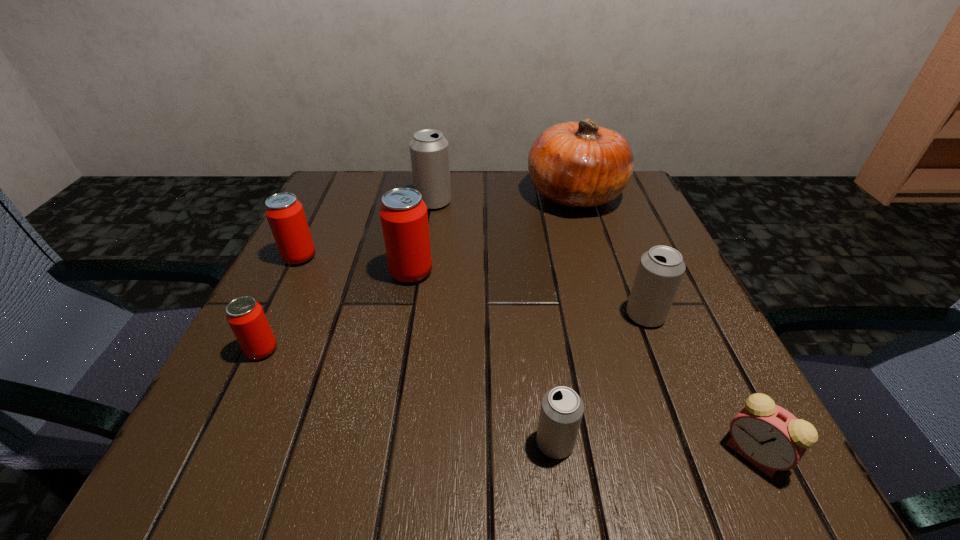
You are a GUI agent. You are given a task and a screenshot of the screen. Output one action in this format:
    pyautogui.click(x=<x>, y=<y>)
    Task: Click on the free space located on the face of the pink alarm clock
    The width and height of the screenshot is (960, 540).
    Given the screenshot: What is the action you would take?
    pyautogui.click(x=602, y=454)

Where is `free space located 0.130m on the face of the pink alarm clock`? The width and height of the screenshot is (960, 540). free space located 0.130m on the face of the pink alarm clock is located at coordinates tap(625, 454).

Locate an element on the screen. Image resolution: width=960 pixels, height=540 pixels. pumpkin that is at the far edge is located at coordinates (580, 164).

Find the location of `beer can that is positioned at the far edge`. beer can that is positioned at the far edge is located at coordinates (429, 150).

This screenshot has width=960, height=540. Find the location of `beer can that is at the near edge`. beer can that is at the near edge is located at coordinates (561, 412).

The width and height of the screenshot is (960, 540). Find the location of `alarm clock that is at the near edge`. alarm clock that is at the near edge is located at coordinates (771, 438).

You are a GUI agent. You are given a task and a screenshot of the screen. Output one action in this format:
    pyautogui.click(x=<x>, y=<y>)
    Task: Click on the pumpkin that is at the right edge
    This screenshot has width=960, height=540.
    Given the screenshot: What is the action you would take?
    [x=580, y=164]

Where is `beer can that is at the right edge`? This screenshot has width=960, height=540. beer can that is at the right edge is located at coordinates (660, 271).

Identify the location of alarm clock situated at the right edge. Image resolution: width=960 pixels, height=540 pixels. (771, 438).

The width and height of the screenshot is (960, 540). In order to click on object located in the far right corner section of the desktop in this screenshot , I will do `click(580, 164)`.